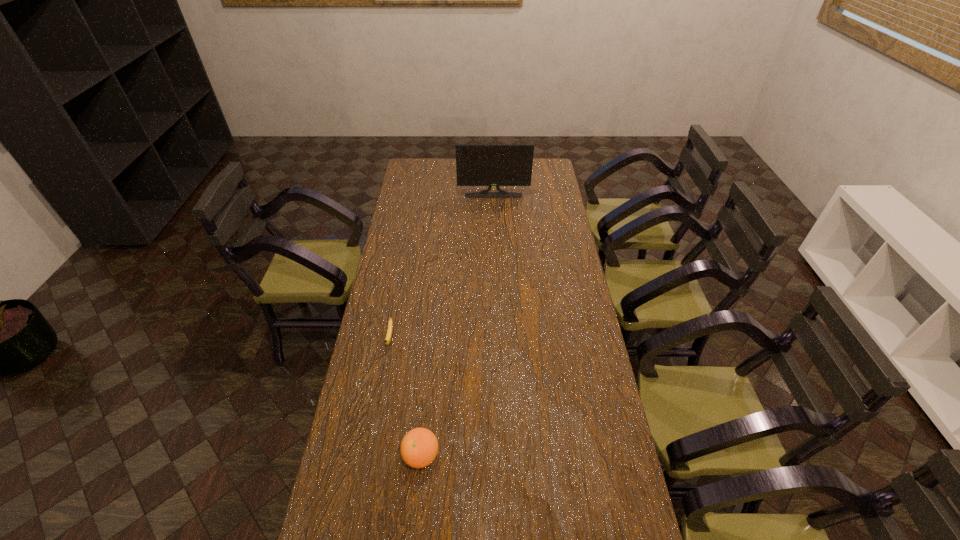
Identify the location of object at the right edge. The width and height of the screenshot is (960, 540). (489, 165).

This screenshot has width=960, height=540. Find the location of `vacant space at the left edge of the desktop`. vacant space at the left edge of the desktop is located at coordinates (359, 400).

Find the location of a particular element. This screenshot has height=540, width=960. blank space at the right edge is located at coordinates (573, 259).

You are a GUI agent. You are given a task and a screenshot of the screen. Output one action in this format:
    pyautogui.click(x=<x>, y=<y>)
    Task: Click on the vacant space at the far left corner of the desktop
    
    Given the screenshot: What is the action you would take?
    pyautogui.click(x=415, y=176)

In order to click on blank region between the rightmost object and the second farthest object in this screenshot , I will do `click(442, 267)`.

The width and height of the screenshot is (960, 540). In order to click on free spot between the second tallest object and the leftmost object in this screenshot , I will do `click(405, 397)`.

You are a GUI agent. You are given a task and a screenshot of the screen. Output one action in this format:
    pyautogui.click(x=<x>, y=<y>)
    Task: Click on the free spot between the orange and the banana
    The height and width of the screenshot is (540, 960).
    Given the screenshot: What is the action you would take?
    pyautogui.click(x=405, y=397)

This screenshot has width=960, height=540. I want to click on empty space between the tallest object and the orange, so click(x=457, y=326).

The image size is (960, 540). Find the location of `vacant area that lies between the leftmost object and the second object from right to left`. vacant area that lies between the leftmost object and the second object from right to left is located at coordinates (405, 397).

Where is `empty space between the second tallest object and the leftmost object`? empty space between the second tallest object and the leftmost object is located at coordinates (405, 397).